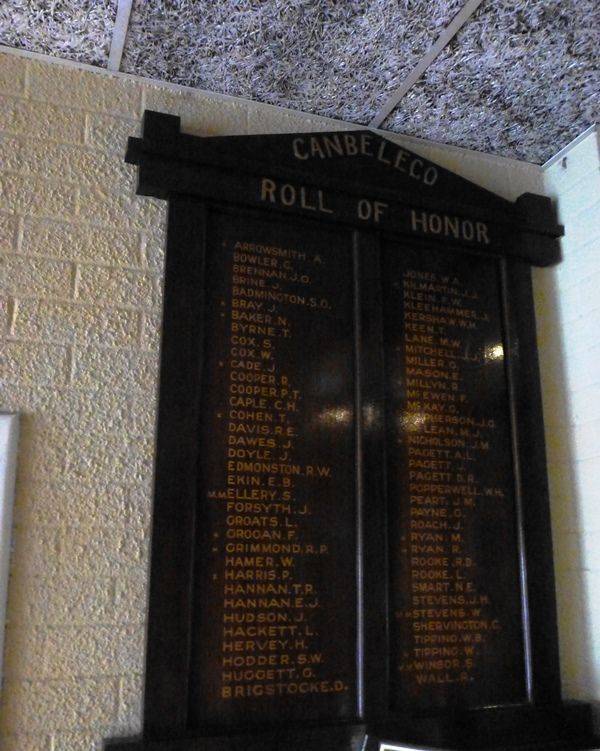
Identify the location of display case. This screenshot has height=751, width=600. (216, 179).